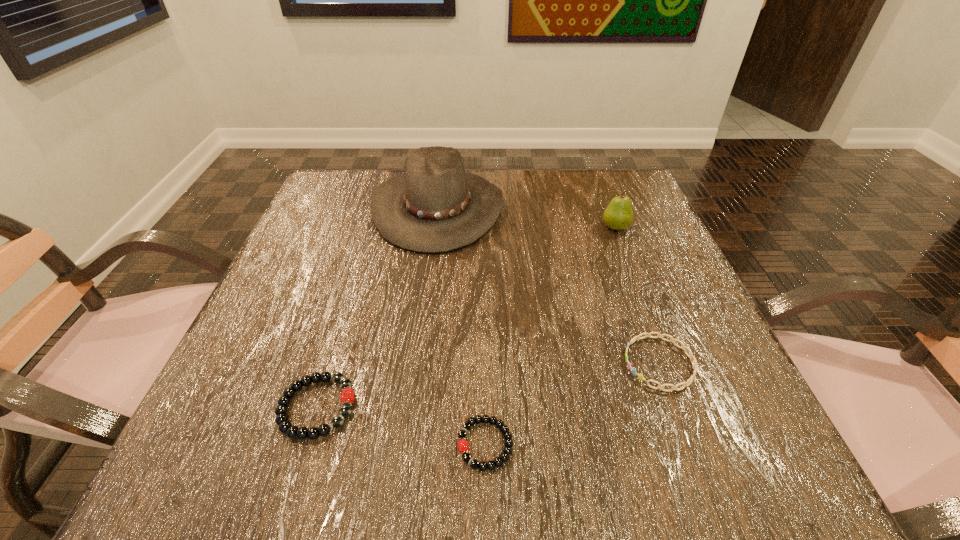
Point out which object is positioned as the fourth nearest to the rightmost bracelet. Please provide its 2D coordinates. Your answer should be formatted as a tuple, i.e. [(x, y)], where the tuple contains the x and y coordinates of a point satisfying the conditions above.

[(285, 426)]

Locate which bracelet ranks second in proximity to the rightmost bracelet. Please provide its 2D coordinates. Your answer should be formatted as a tuple, i.e. [(x, y)], where the tuple contains the x and y coordinates of a point satisfying the conditions above.

[(285, 426)]

Identify which bracelet is the second nearest to the shortest object. Please provide its 2D coordinates. Your answer should be formatted as a tuple, i.e. [(x, y)], where the tuple contains the x and y coordinates of a point satisfying the conditions above.

[(694, 364)]

Image resolution: width=960 pixels, height=540 pixels. Find the location of `free space that satisfies the following two spatial constraints: 1. on the surface of the rightmost bracelet showing star-shaped elements; 2. on the front side of the shortest bracelet`. free space that satisfies the following two spatial constraints: 1. on the surface of the rightmost bracelet showing star-shaped elements; 2. on the front side of the shortest bracelet is located at coordinates (689, 444).

This screenshot has width=960, height=540. I want to click on free space that satisfies the following two spatial constraints: 1. on the back side of the second tallest object; 2. on the left side of the shortest object, so click(483, 227).

Where is `free space that satisfies the following two spatial constraints: 1. on the surface of the rightmost bracelet showing star-shaped elements; 2. on the front side of the shortest bracelet`? This screenshot has height=540, width=960. free space that satisfies the following two spatial constraints: 1. on the surface of the rightmost bracelet showing star-shaped elements; 2. on the front side of the shortest bracelet is located at coordinates (689, 444).

Where is `free space in the image that satisfies the following two spatial constraints: 1. on the front side of the second tallest object; 2. on the surface of the rightmost bracelet showing star-shaped elements`? The height and width of the screenshot is (540, 960). free space in the image that satisfies the following two spatial constraints: 1. on the front side of the second tallest object; 2. on the surface of the rightmost bracelet showing star-shaped elements is located at coordinates (668, 363).

Find the location of a particular element. This screenshot has width=960, height=540. vacant space that satisfies the following two spatial constraints: 1. on the front-facing side of the hat; 2. on the left side of the shortest bracelet is located at coordinates (408, 444).